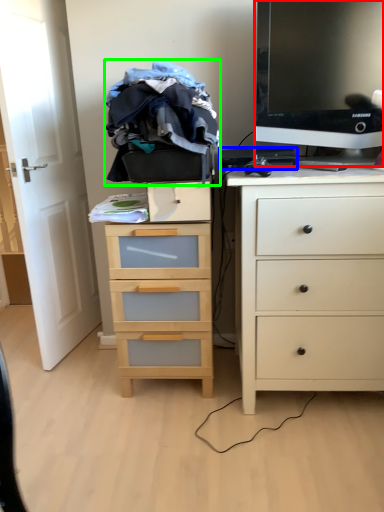
Question: Which object is positioned closest to television (highlighted by a red box)? Select from computer keyboard (highlighted by a blue box) and clothing (highlighted by a green box).

Choices:
 (A) computer keyboard
 (B) clothing

Answer: (A)